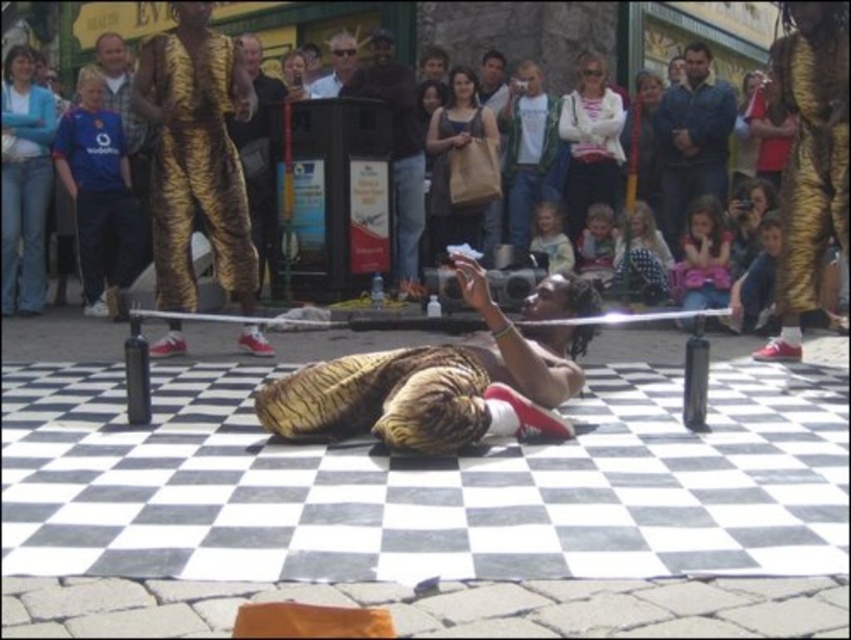
Which of these two, blue denim jeans at upper left or metallic gold suit at center, stands taller?

Standing taller between the two is metallic gold suit at center.

Between point (41, 221) and point (393, 250), which one is positioned behind?

The point (393, 250) is behind.

Identify the location of blue denim jeans at upper left. Image resolution: width=851 pixels, height=640 pixels. (24, 182).

This screenshot has width=851, height=640. What do you see at coordinates (528, 29) in the screenshot? I see `golden fur coat at center` at bounding box center [528, 29].

Does golden fur coat at center appear under blue denim jacket at upper center?

Actually, golden fur coat at center is above blue denim jacket at upper center.

You are a GUI agent. You are given a task and a screenshot of the screen. Output one action in this format:
    pyautogui.click(x=<x>, y=<y>)
    Task: Click on the golden fur coat at center
    The image size is (851, 640).
    Given the screenshot: What is the action you would take?
    pyautogui.click(x=528, y=29)

Does gold metallic costume at upper right appear on the left side of blue denim jeans at upper left?

Incorrect, gold metallic costume at upper right is not on the left side of blue denim jeans at upper left.

From the picture: Is gold metallic costume at upper right smaller than blue denim jeans at upper left?

Result: No.

What do you see at coordinates (809, 160) in the screenshot?
I see `gold metallic costume at upper right` at bounding box center [809, 160].

At what (x,y) coordinates should I click in order to perform the action: click on gold metallic costume at upper right. Please return your answer as a coordinate pair (x, y). The height and width of the screenshot is (640, 851). Looking at the image, I should click on (809, 160).